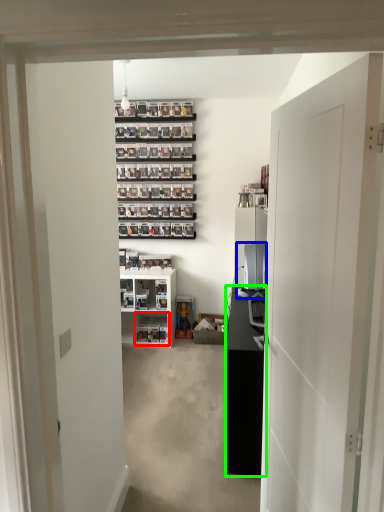
Question: Which is nearer to the shelf (highlighted by a red box)? desktop computer (highlighted by a blue box) or cabinetry (highlighted by a green box).

Choices:
 (A) desktop computer
 (B) cabinetry

Answer: (A)